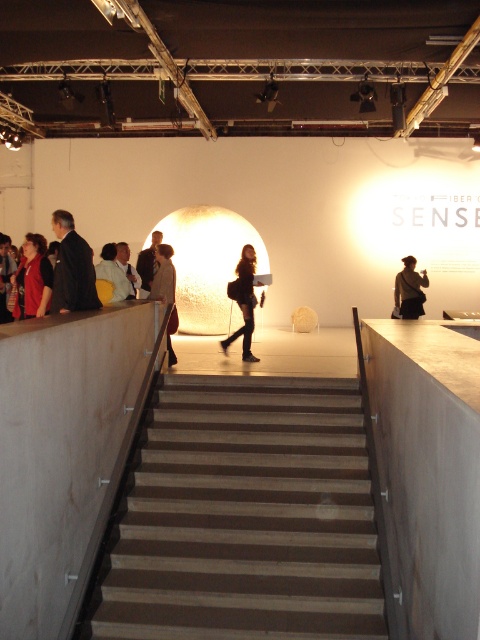
Question: Based on their relative distances, which object is farther from the dark brown leather jacket at center?

Choices:
 (A) matte red shirt at left
 (B) wooden stairs at center

Answer: (B)

Question: Is brown leather jacket at center above dark brown leather jacket at center?

Choices:
 (A) yes
 (B) no

Answer: (B)

Question: Is black leather jacket at center thinner than light beige suit at center?

Choices:
 (A) no
 (B) yes

Answer: (A)

Question: Which point is farther to the camera?

Choices:
 (A) (414, 310)
 (B) (248, 314)

Answer: (A)

Question: Estimate the real-world distances between objects in this image. Which object is closer to the light beige suit at center?

Choices:
 (A) brown leather jacket at center
 (B) dark suit at left

Answer: (A)

Question: Does matte red shirt at left have a smaller size compared to light beige suit at center?

Choices:
 (A) yes
 (B) no

Answer: (A)